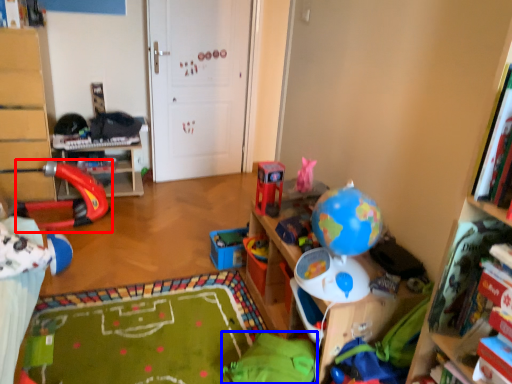
Question: Which object is further to the camera taking this photo, toy (highlighted by a red box) or bean bag chair (highlighted by a blue box)?

Choices:
 (A) toy
 (B) bean bag chair

Answer: (A)